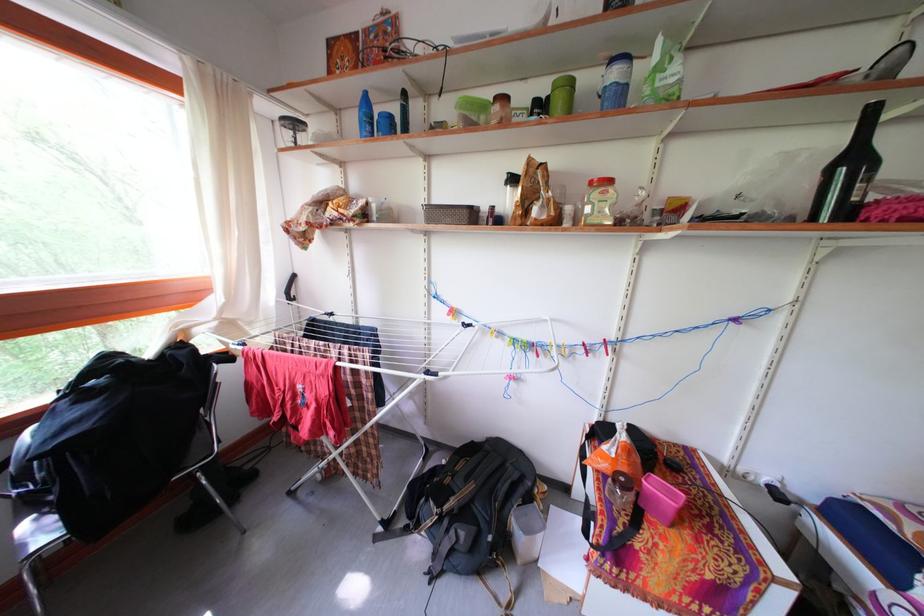
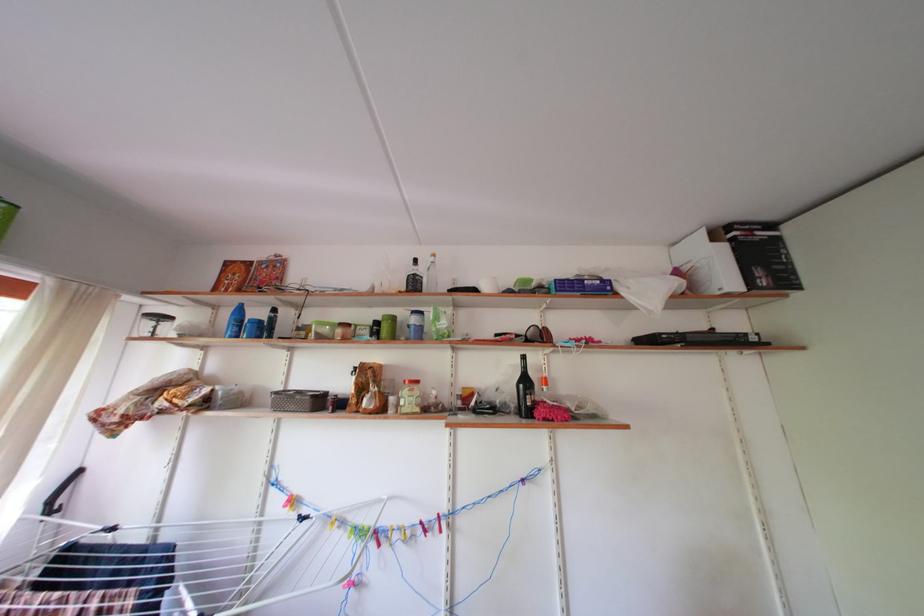
Where in the second image is the point corresponding to point (861, 166) from the first image?

(533, 387)